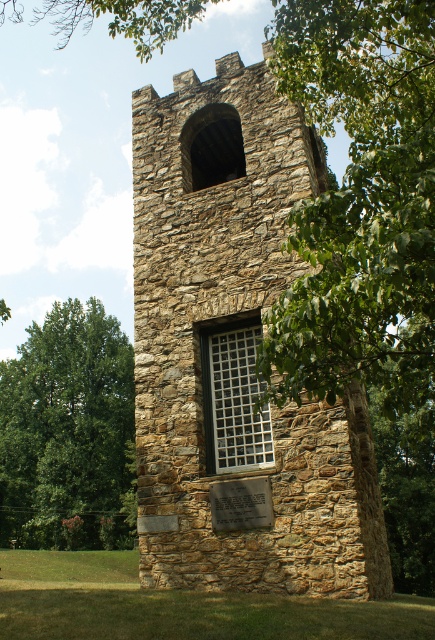
Which is more to the right, brown stone tower at center or green leafy tree at left?

Positioned to the right is brown stone tower at center.

Can you confirm if brown stone tower at center is positioned to the left of green leafy tree at left?

No, brown stone tower at center is not to the left of green leafy tree at left.

Where is `brown stone tower at center`? brown stone tower at center is located at coordinates (236, 352).

The image size is (435, 640). In order to click on brown stone tower at center in this screenshot , I will do `click(236, 352)`.

The width and height of the screenshot is (435, 640). What do you see at coordinates (69, 433) in the screenshot?
I see `green leafy tree at left` at bounding box center [69, 433].

Is green leafy tree at left taller than white grid glass at center?

Yes, green leafy tree at left is taller than white grid glass at center.

What are the coordinates of `green leafy tree at left` in the screenshot? It's located at (69, 433).

Does brown stone tower at center have a greater width compared to white grid glass at center?

Yes.

Who is positioned more to the right, brown stone tower at center or white grid glass at center?

From the viewer's perspective, brown stone tower at center appears more on the right side.

The height and width of the screenshot is (640, 435). Find the location of `brown stone tower at center`. brown stone tower at center is located at coordinates (236, 352).

Where is `brown stone tower at center`? This screenshot has width=435, height=640. brown stone tower at center is located at coordinates (236, 352).